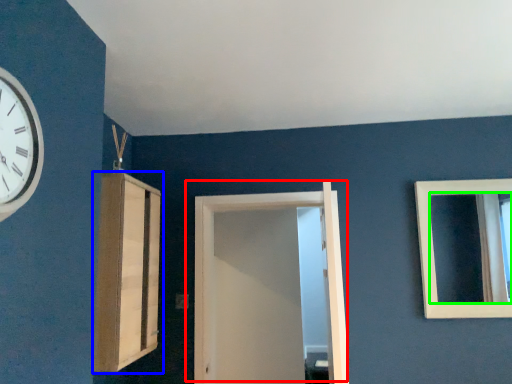
Question: Based on their relative distances, which object is nearer to door (highlighted by a red box)? Choose from cabinetry (highlighted by a blue box) and mirror (highlighted by a green box).

Choices:
 (A) cabinetry
 (B) mirror

Answer: (A)